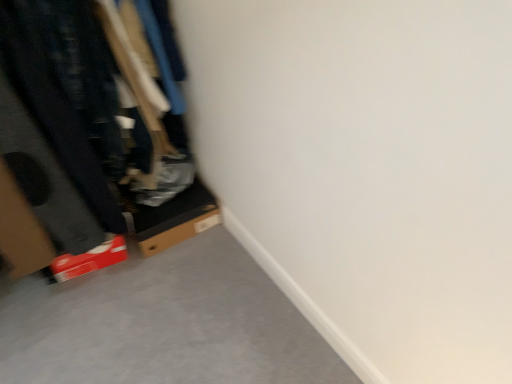
Question: Does cardboard box at left have a larger size compared to cardboard box at lower left?

Choices:
 (A) yes
 (B) no

Answer: (A)

Question: Is cardboard box at left aimed at cardboard box at lower left?

Choices:
 (A) yes
 (B) no

Answer: (B)

Question: Is cardboard box at left to the right of cardboard box at lower left from the viewer's perspective?

Choices:
 (A) no
 (B) yes

Answer: (A)

Question: Does cardboard box at left lie behind cardboard box at lower left?

Choices:
 (A) no
 (B) yes

Answer: (A)

Question: Is cardboard box at lower left completely or partially inside cardboard box at left?

Choices:
 (A) yes
 (B) no

Answer: (B)

Question: From the image's perspective, is cardboard box at left beneath cardboard box at lower left?

Choices:
 (A) no
 (B) yes

Answer: (A)

Question: Is cardboard box at lower left facing away from cardboard box at left?

Choices:
 (A) yes
 (B) no

Answer: (B)

Question: Can you confirm if cardboard box at lower left is thinner than cardboard box at left?

Choices:
 (A) yes
 (B) no

Answer: (A)

Question: Considering the relative positions of cardboard box at lower left and cardboard box at left in the image provided, is cardboard box at lower left behind cardboard box at left?

Choices:
 (A) no
 (B) yes

Answer: (B)

Question: Is cardboard box at lower left wider than cardboard box at left?

Choices:
 (A) no
 (B) yes

Answer: (A)

Question: From a real-world perspective, is cardboard box at lower left over cardboard box at left?

Choices:
 (A) yes
 (B) no

Answer: (B)

Question: Does cardboard box at lower left appear on the right side of cardboard box at left?

Choices:
 (A) yes
 (B) no

Answer: (A)

Question: In terms of width, does cardboard box at left look wider or thinner when compared to cardboard box at lower left?

Choices:
 (A) wide
 (B) thin

Answer: (A)